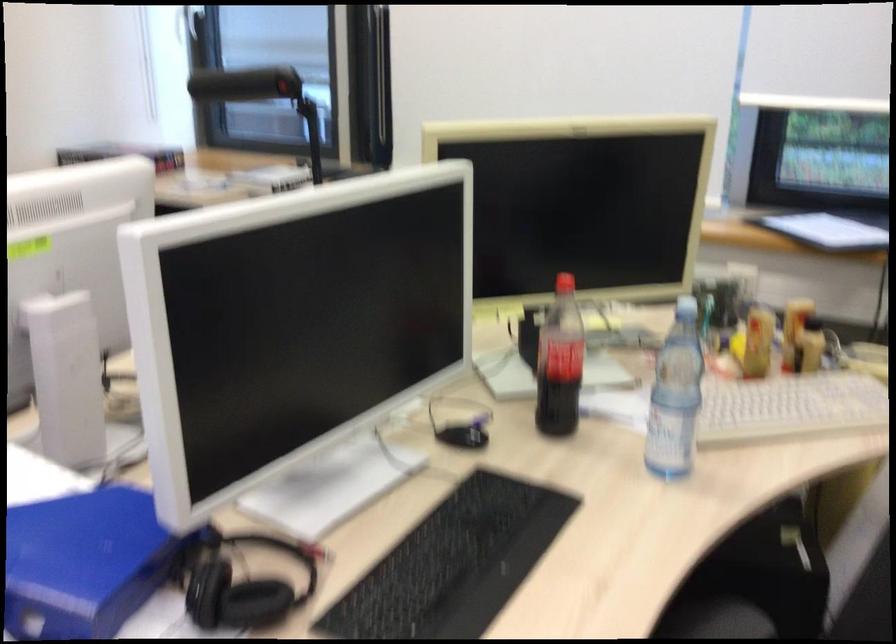
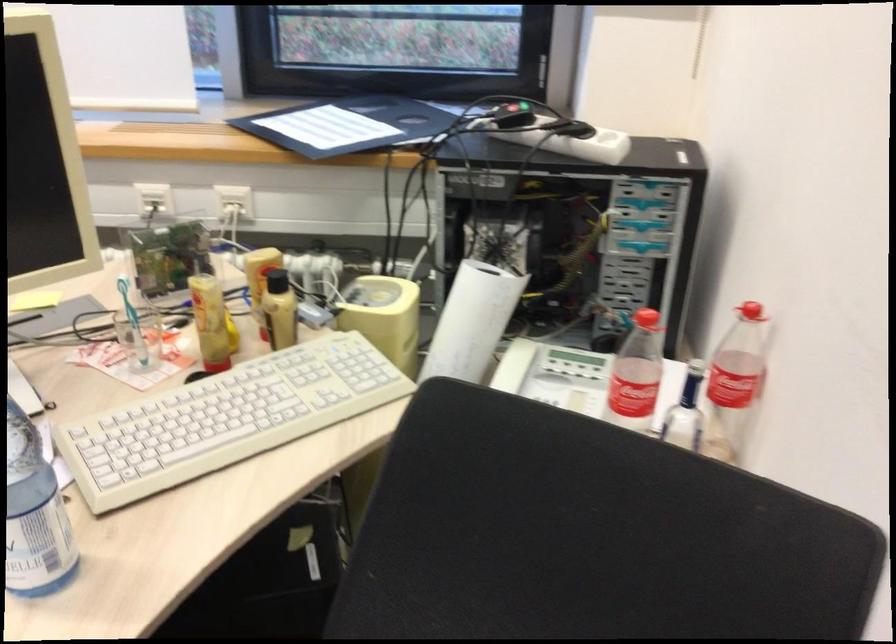
Which direction would the cameraman need to move to produce the second image?

The movement direction of the cameraman is right, forward.